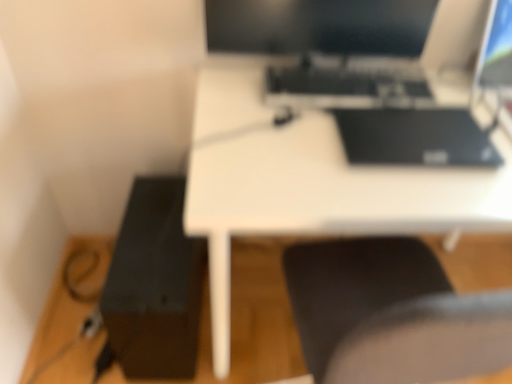
The image size is (512, 384). What are the coordinates of `blank space to the left of matte black monitor at upper right` in the screenshot? It's located at (458, 82).